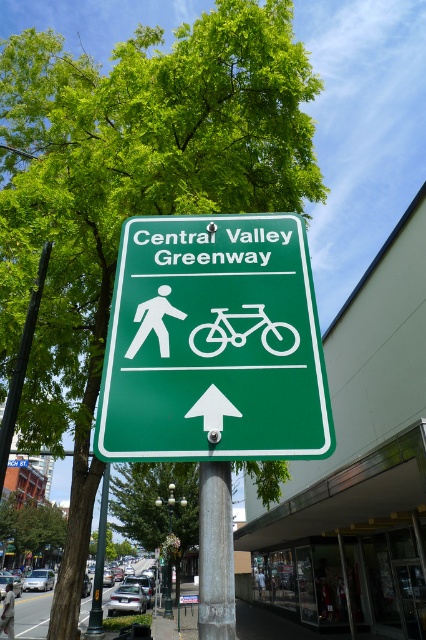
You are a delivery person who needs to load a light brown leather jacket at upper center onto a white matte bicycle at center. Can you place the jacket on the bicycle without folding it first?

The white matte bicycle at center has a lesser height compared to the light brown leather jacket at upper center, so the jacket cannot be placed on the bicycle without folding it first.

You are a painter who wants to paint the white matte bicycle at center and the metallic pole at lower left. Which object should you use less paint on?

The white matte bicycle at center is thinner than the metallic pole at lower left, so you should use less paint on the white matte bicycle at center.

You are a hiker trying to determine the direction to the Central Valley Greenway. You see the metallic pole at lower left and the white plastic pedestrian at upper center. Which object is taller?

The metallic pole at lower left is taller than the white plastic pedestrian at upper center.